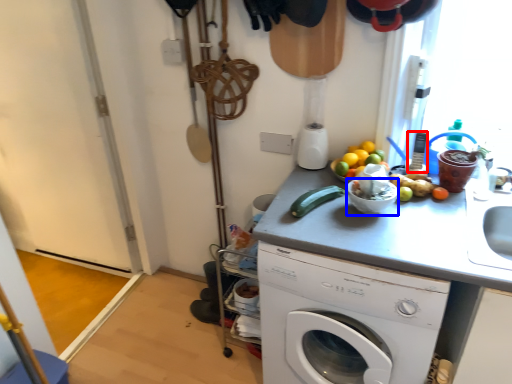
Question: Which point is closer to the camera, appliance (highlighted by a red box) or basin (highlighted by a blue box)?

Choices:
 (A) appliance
 (B) basin

Answer: (B)